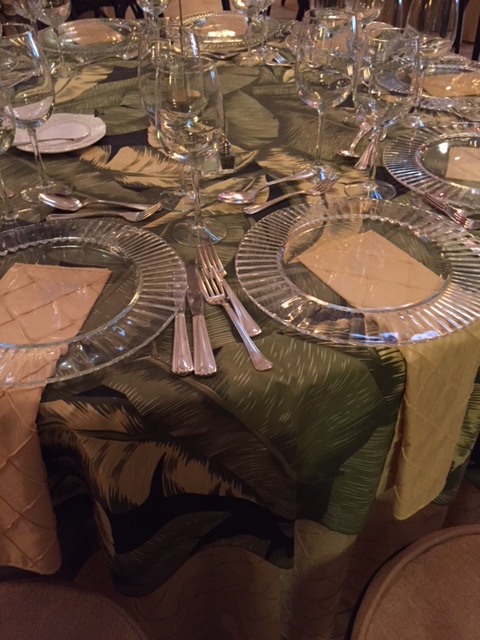
Where is `black areas on tablecloth`? Image resolution: width=480 pixels, height=640 pixels. black areas on tablecloth is located at coordinates (126, 136), (122, 72), (253, 168), (279, 192), (274, 209), (385, 171).